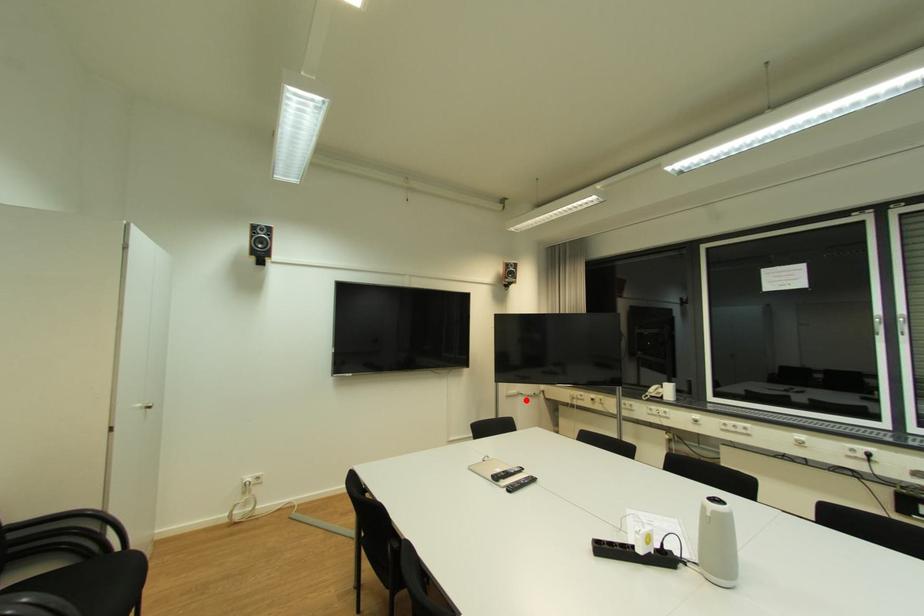
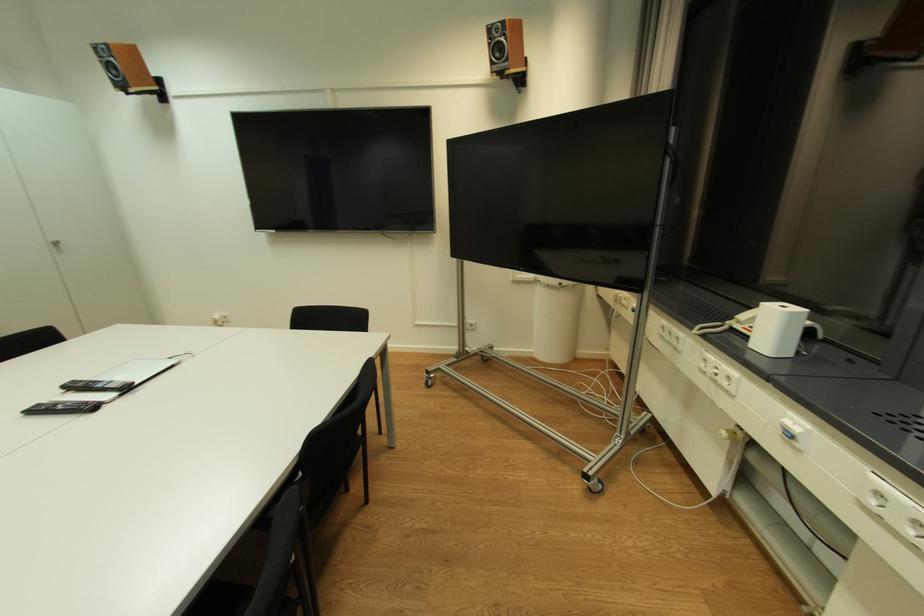
Question: I am providing you with two images of the same scene from different viewpoints. A red point is shown in image1. For the corresponding object point in image2, is it positioned nearer or farther from the camera?

Choices:
 (A) Nearer
 (B) Farther

Answer: (A)